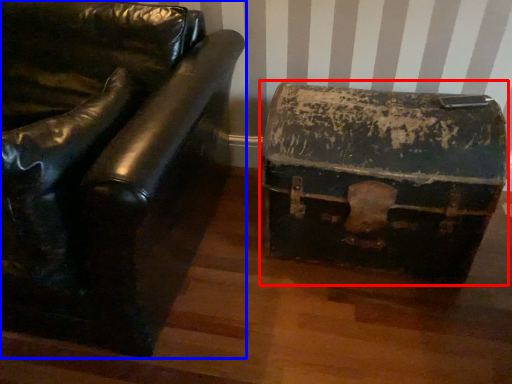
Question: Among these objects, which one is farthest to the camera, storage box (highlighted by a red box) or furniture (highlighted by a blue box)?

Choices:
 (A) storage box
 (B) furniture

Answer: (A)